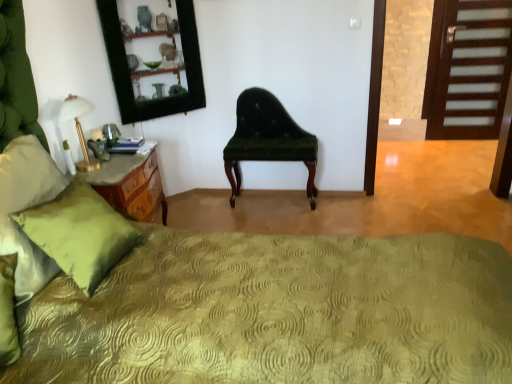
Locate an element on the screen. free space in front of dark wood door at right is located at coordinates (472, 151).